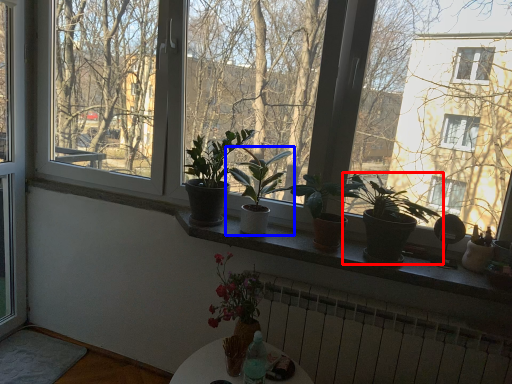
Question: Which point is closer to the camera, houseplant (highlighted by a red box) or houseplant (highlighted by a blue box)?

Choices:
 (A) houseplant
 (B) houseplant

Answer: (A)